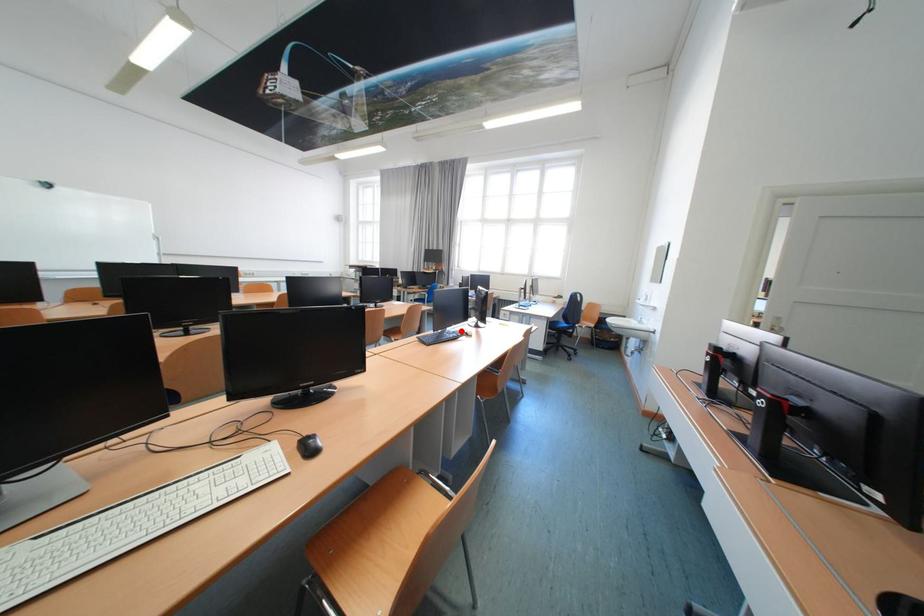
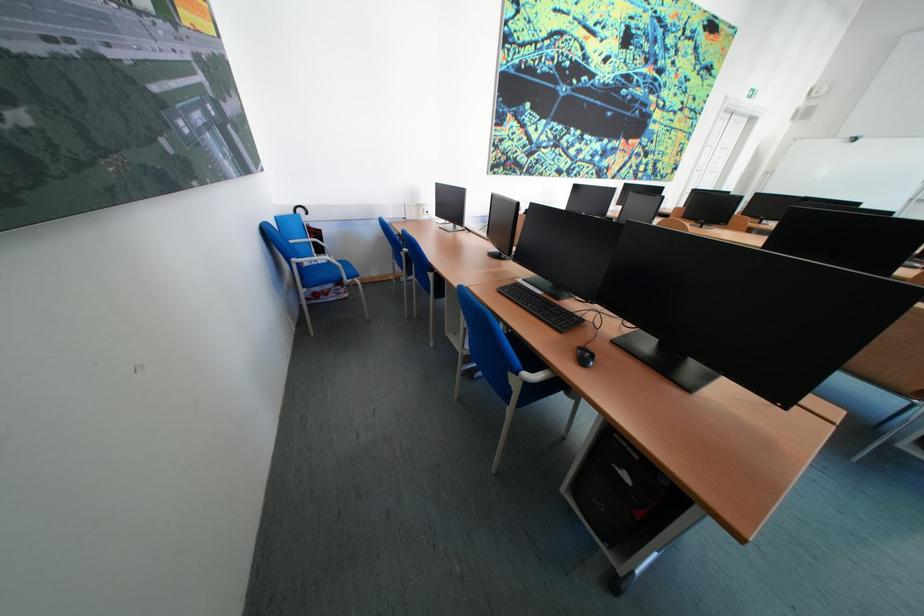
Question: I am providing you with two images of the same scene from different viewpoints. A red point is marked on the first image. Is the red point's position out of view in image 2?

Choices:
 (A) Yes
 (B) No

Answer: (A)